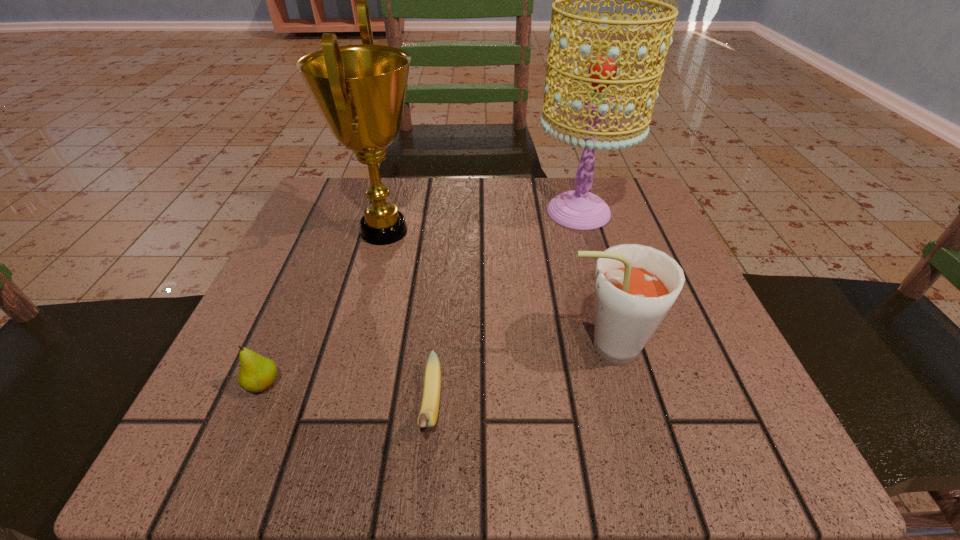
Where is `free area in between the shortest object and the lampshade`? free area in between the shortest object and the lampshade is located at coordinates (505, 309).

Identify the location of free space between the fourth object from right to left and the leftmost object. (324, 308).

Where is `vacant space that is in between the second shortest object and the fourth object from right to left`? vacant space that is in between the second shortest object and the fourth object from right to left is located at coordinates (324, 308).

Find the location of a particular element. unoccupied position between the second shortest object and the lampshade is located at coordinates (421, 298).

Find the location of a particular element. The width and height of the screenshot is (960, 540). free area in between the lampshade and the third shortest object is located at coordinates (591, 279).

You are a GUI agent. You are given a task and a screenshot of the screen. Output one action in this format:
    pyautogui.click(x=<x>, y=<y>)
    Task: Click on the free point between the second shortest object and the shortest object
    
    Given the screenshot: What is the action you would take?
    pyautogui.click(x=348, y=395)

Find the location of a particular element. Image resolution: width=960 pixels, height=540 pixels. free spot between the lampshade and the shortest object is located at coordinates (505, 309).

Locate an element on the screen. This screenshot has height=540, width=960. vacant space that is in between the pear and the lampshade is located at coordinates (421, 298).

The image size is (960, 540). Find the location of `object that is the second closest to the third tallest object`. object that is the second closest to the third tallest object is located at coordinates [579, 209].

Identify the location of object that ranks as the second closest to the lampshade. The width and height of the screenshot is (960, 540). (360, 90).